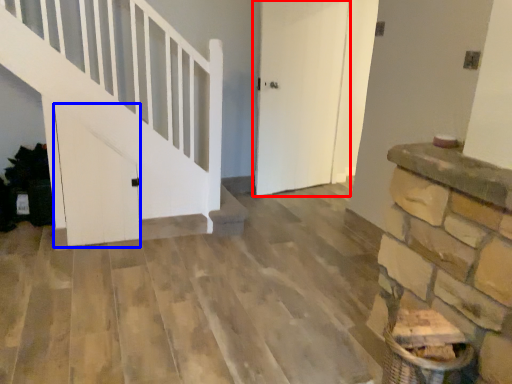
Question: Which of the following is the farthest to the observer, door (highlighted by a red box) or door (highlighted by a blue box)?

Choices:
 (A) door
 (B) door

Answer: (A)